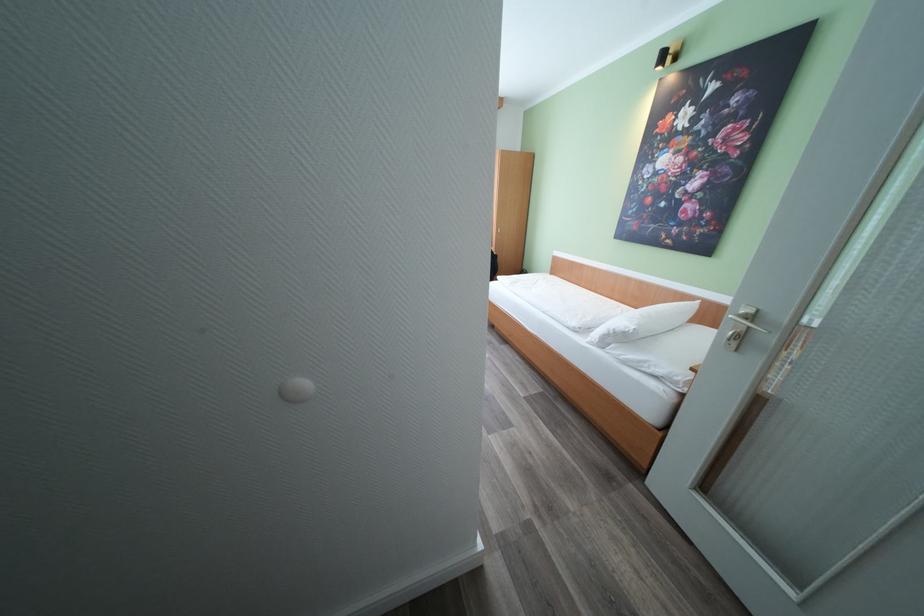
Find where to lift the white pillow. Please return your answer as a coordinate pair (x, y).

(641, 323)